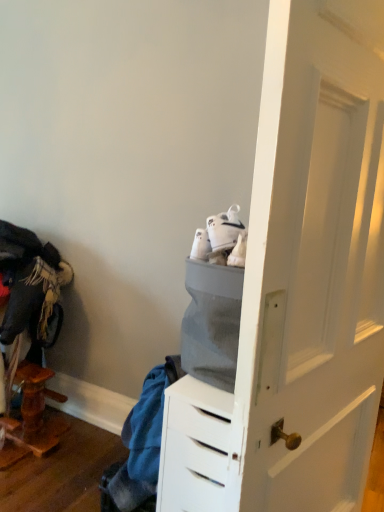
Question: Considering the relative positions of white suede sneakers at center and blue fabric at lower left in the image provided, is white suede sneakers at center to the left of blue fabric at lower left from the viewer's perspective?

Choices:
 (A) yes
 (B) no

Answer: (B)

Question: Considering the relative sizes of white suede sneakers at center and blue fabric at lower left in the image provided, is white suede sneakers at center bigger than blue fabric at lower left?

Choices:
 (A) no
 (B) yes

Answer: (A)

Question: From the image's perspective, is white suede sneakers at center below blue fabric at lower left?

Choices:
 (A) yes
 (B) no

Answer: (B)

Question: Does white suede sneakers at center have a greater width compared to blue fabric at lower left?

Choices:
 (A) no
 (B) yes

Answer: (A)

Question: From the image's perspective, is white suede sneakers at center over blue fabric at lower left?

Choices:
 (A) no
 (B) yes

Answer: (B)

Question: Would you say white suede sneakers at center is a long distance from blue fabric at lower left?

Choices:
 (A) yes
 (B) no

Answer: (B)

Question: Does blue fabric at lower left appear on the right side of white suede sneakers at center?

Choices:
 (A) yes
 (B) no

Answer: (B)

Question: Is blue fabric at lower left directly adjacent to white suede sneakers at center?

Choices:
 (A) no
 (B) yes

Answer: (A)

Question: Is blue fabric at lower left facing towards white suede sneakers at center?

Choices:
 (A) yes
 (B) no

Answer: (B)

Question: From the image's perspective, does blue fabric at lower left appear higher than white suede sneakers at center?

Choices:
 (A) yes
 (B) no

Answer: (B)

Question: From a real-world perspective, is blue fabric at lower left positioned under white suede sneakers at center based on gravity?

Choices:
 (A) yes
 (B) no

Answer: (A)

Question: From the image's perspective, is blue fabric at lower left located beneath white suede sneakers at center?

Choices:
 (A) yes
 (B) no

Answer: (A)

Question: Looking at the image, does white suede sneakers at center seem bigger or smaller compared to blue fabric at lower left?

Choices:
 (A) big
 (B) small

Answer: (B)